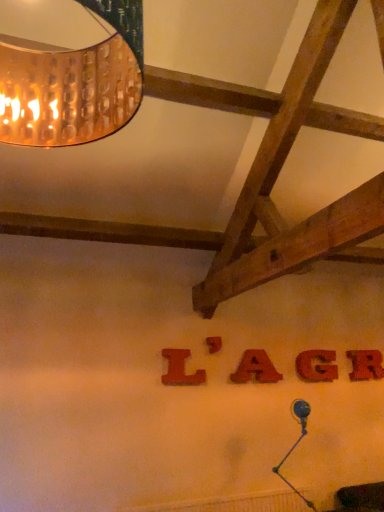
Question: Are red matte letter g at center, the 4th letter when ordered from left to right, and red felt letter a at center, which is the 3th letter from right to left, located far from each other?

Choices:
 (A) no
 (B) yes

Answer: (A)

Question: Is red matte letter g at center, marked as the 2th letter in a right-to-left arrangement, further to the viewer compared to red felt letter a at center, which ranks as the third letter in left-to-right order?

Choices:
 (A) no
 (B) yes

Answer: (B)

Question: From a real-world perspective, does red matte letter g at center, the 4th letter when ordered from left to right, sit lower than red felt letter a at center, which is the 3th letter from right to left?

Choices:
 (A) yes
 (B) no

Answer: (A)

Question: Is red matte letter g at center, the 4th letter when ordered from left to right, oriented towards red felt letter a at center, which is the 3th letter from right to left?

Choices:
 (A) no
 (B) yes

Answer: (A)

Question: Can we say red matte letter g at center, the 4th letter when ordered from left to right, lies outside red felt letter a at center, which ranks as the third letter in left-to-right order?

Choices:
 (A) yes
 (B) no

Answer: (A)

Question: Based on their sizes in the image, would you say red wood letter at center, the fifth letter viewed from the left, is bigger or smaller than red matte letter g at center, marked as the 2th letter in a right-to-left arrangement?

Choices:
 (A) big
 (B) small

Answer: (A)

Question: Is red wood letter at center, the fifth letter viewed from the left, in front of or behind red matte letter g at center, marked as the 2th letter in a right-to-left arrangement, in the image?

Choices:
 (A) front
 (B) behind

Answer: (B)

Question: Is red wood letter at center, the fifth letter viewed from the left, spatially inside red matte letter g at center, the 4th letter when ordered from left to right, or outside of it?

Choices:
 (A) outside
 (B) inside

Answer: (A)

Question: Is point (370, 351) positioned closer to the camera than point (332, 352)?

Choices:
 (A) closer
 (B) farther

Answer: (B)

Question: Is red matte letter g at center, the 4th letter when ordered from left to right, in front of or behind red wood letter at center, placed as the 1th letter when sorted from right to left, in the image?

Choices:
 (A) behind
 (B) front

Answer: (B)

Question: In terms of width, does red matte letter g at center, the 4th letter when ordered from left to right, look wider or thinner when compared to red wood letter at center, the fifth letter viewed from the left?

Choices:
 (A) thin
 (B) wide

Answer: (B)

Question: Is point (321, 379) positioned closer to the camera than point (357, 360)?

Choices:
 (A) closer
 (B) farther

Answer: (A)

Question: Considering the positions of red matte letter g at center, the 4th letter when ordered from left to right, and red wood letter at center, placed as the 1th letter when sorted from right to left, in the image, is red matte letter g at center, the 4th letter when ordered from left to right, bigger or smaller than red wood letter at center, placed as the 1th letter when sorted from right to left,?

Choices:
 (A) big
 (B) small

Answer: (B)

Question: From a real-world perspective, is red wood letter at center, placed as the 1th letter when sorted from right to left, positioned above or below wooden letter at center, the 4th letter in the right-to-left sequence?

Choices:
 (A) above
 (B) below

Answer: (B)

Question: In terms of size, does red wood letter at center, placed as the 1th letter when sorted from right to left, appear bigger or smaller than wooden letter at center, the 4th letter in the right-to-left sequence?

Choices:
 (A) big
 (B) small

Answer: (A)